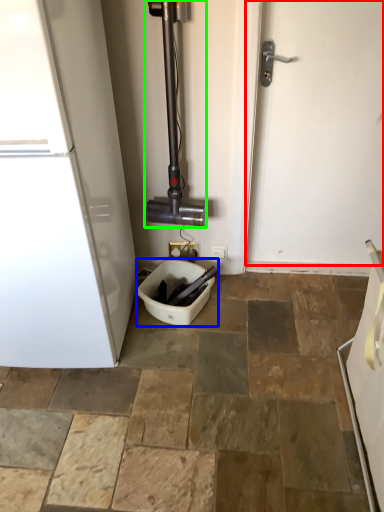
Question: Which object is positioned closest to door (highlighted by a red box)? Select from toilet bowl (highlighted by a blue box) and pipe (highlighted by a green box).

Choices:
 (A) toilet bowl
 (B) pipe

Answer: (B)